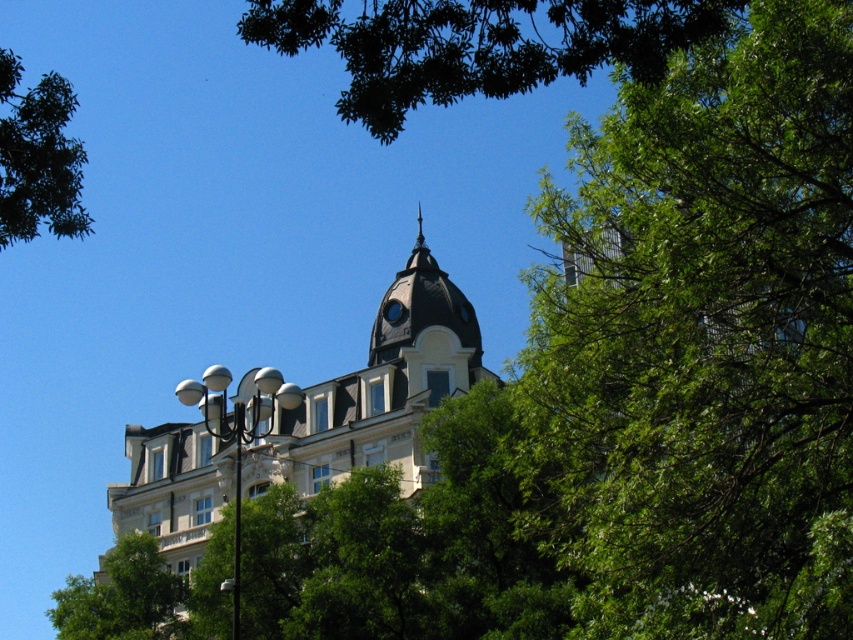
Question: Is green leafy tree at upper right to the right of green leafy tree at upper left from the viewer's perspective?

Choices:
 (A) no
 (B) yes

Answer: (B)

Question: Which object is closer to the camera taking this photo?

Choices:
 (A) green leafy tree at upper right
 (B) green leafy tree at lower left
 (C) white stone building at center

Answer: (A)

Question: Which object is closer to the camera taking this photo?

Choices:
 (A) green leafy tree at lower left
 (B) green leafy tree at upper left

Answer: (B)

Question: Based on their relative distances, which object is nearer to the green leafy tree at upper center?

Choices:
 (A) white glossy lamp post at center-left
 (B) green leafy tree at upper right

Answer: (B)

Question: Can you confirm if green leafy tree at upper right is smaller than green leafy tree at upper left?

Choices:
 (A) no
 (B) yes

Answer: (B)

Question: Observing the image, what is the correct spatial positioning of green leafy tree at lower left in reference to white glossy lamp post at center-left?

Choices:
 (A) left
 (B) right

Answer: (A)